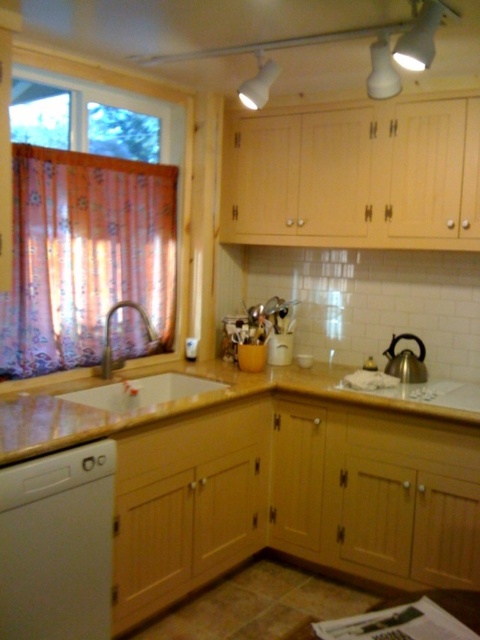
Identify the location of floral fabric curtain at left. The width and height of the screenshot is (480, 640). (86, 259).

Can you confirm if floral fabric curtain at left is shorter than white matte exhaust hood at upper center?

No.

Is point (36, 289) in front of point (437, 20)?

No.

This screenshot has height=640, width=480. I want to click on floral fabric curtain at left, so click(86, 259).

Which of these two, floral fabric curtain at left or white matte dishwasher at lower left, stands shorter?

With less height is white matte dishwasher at lower left.

Is point (149, 208) positioned after point (79, 602)?

Yes, point (149, 208) is behind point (79, 602).

Who is more forward, (70, 182) or (99, 637)?

Positioned in front is point (99, 637).

Where is `floral fabric curtain at left`? The width and height of the screenshot is (480, 640). floral fabric curtain at left is located at coordinates (86, 259).